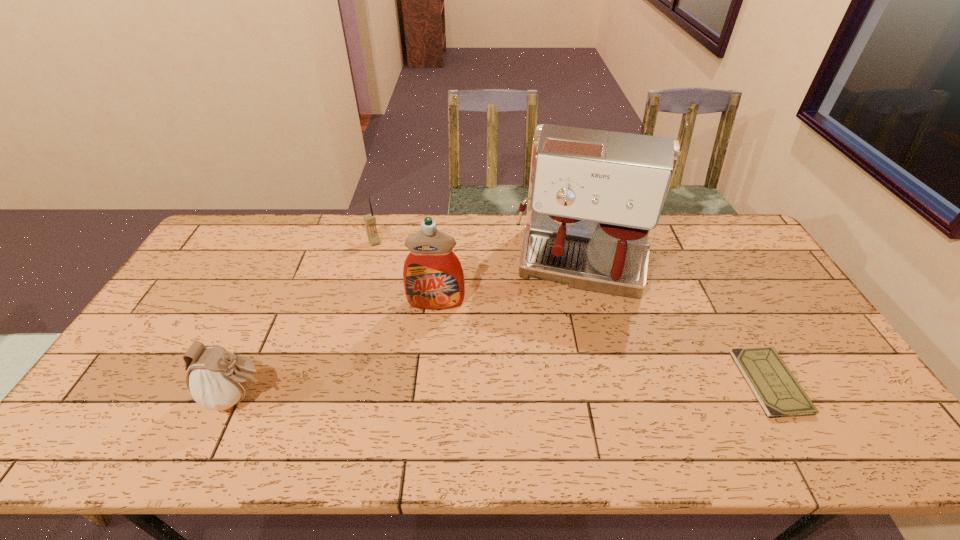
Where is `free space between the fourth object from left to right and the leftmost object`? This screenshot has height=540, width=960. free space between the fourth object from left to right and the leftmost object is located at coordinates (412, 329).

The width and height of the screenshot is (960, 540). In order to click on free space between the coffee maker and the pouch in this screenshot , I will do `click(412, 329)`.

Image resolution: width=960 pixels, height=540 pixels. What are the coordinates of `object that stands as the second closest to the detergent` in the screenshot? It's located at (370, 221).

Image resolution: width=960 pixels, height=540 pixels. Identify the location of the third closest object to the fourth shortest object. (218, 379).

The image size is (960, 540). I want to click on free space that satisfies the following two spatial constraints: 1. on the back side of the tallest object; 2. on the right side of the detergent, so click(x=440, y=262).